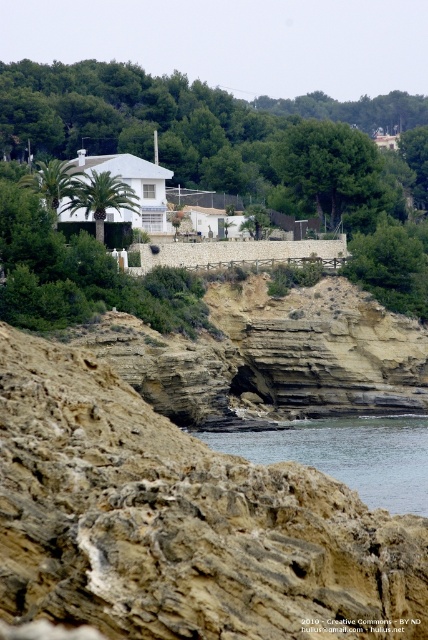
You are a hiker who wants to cross from the brown rocky cliff at lower left to the clear water at lower center. Considering their heights, which one should you start from to descend safely?

The brown rocky cliff at lower left is much taller than the clear water at lower center, so you should start descending from the brown rocky cliff at lower left to reach the clear water at lower center safely.

Consider the image. You are a hiker standing at the base of the brown rocky cliff at lower left and want to reach the clear water at lower center. Can you walk directly to the water from your current position?

The brown rocky cliff at lower left is in front of clear water at lower center, meaning the cliff is blocking the direct path. You cannot walk directly to the clear water at lower center from your current position without going around the cliff.

You are standing at the edge of the brown rocky cliff at lower left and want to reach the clear water at lower center. Which direction should you move to get there?

You should move to the right because the brown rocky cliff at lower left is to the left of clear water at lower center.